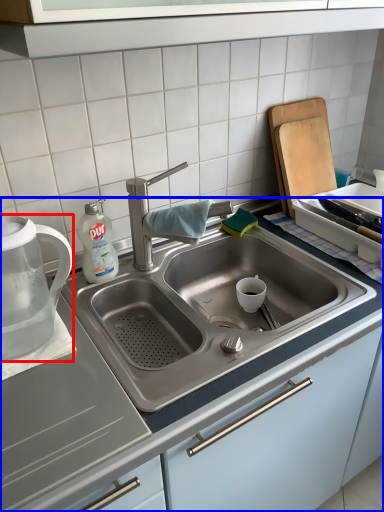
Question: Which object appears closest to the camera in this image, tea pot (highlighted by a red box) or countertop (highlighted by a blue box)?

Choices:
 (A) tea pot
 (B) countertop

Answer: (B)